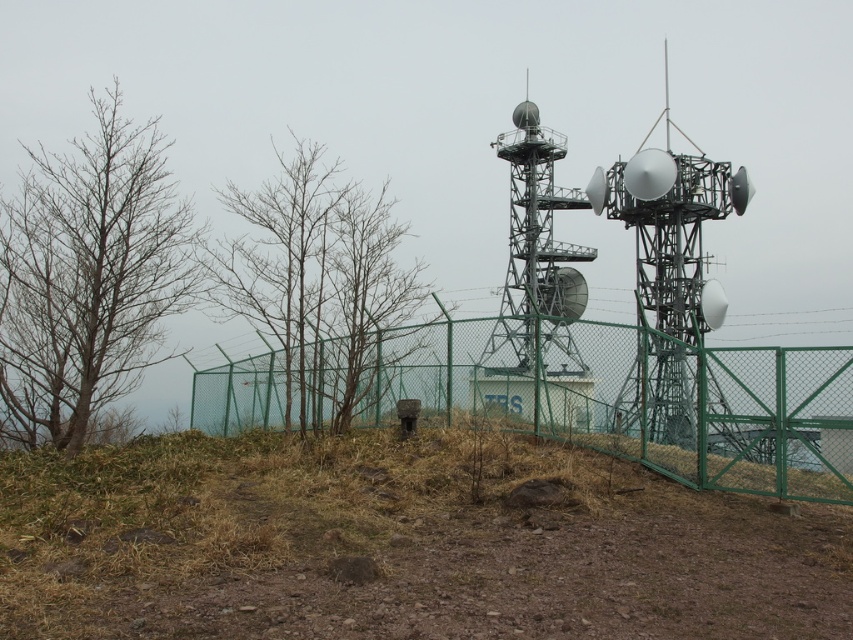
Question: Which of the following is the closest to the observer?

Choices:
 (A) metallic silver satellite dish at right
 (B) bare wood tree at left

Answer: (A)

Question: Does bare wood tree at left appear over bare branches at left?

Choices:
 (A) yes
 (B) no

Answer: (A)

Question: Is bare branches at left behind metallic silver satellite dish at right?

Choices:
 (A) yes
 (B) no

Answer: (A)

Question: Which point is closer to the camera?

Choices:
 (A) (352, 376)
 (B) (550, 356)
 (C) (532, 353)

Answer: (A)

Question: Which object appears closest to the camera in this image?

Choices:
 (A) bare wood tree at left
 (B) metallic silver satellite dish at right
 (C) bare branches at left
 (D) metallic gray tower at center

Answer: (B)

Question: Does bare wood tree at left appear under metallic gray tower at center?

Choices:
 (A) no
 (B) yes

Answer: (B)